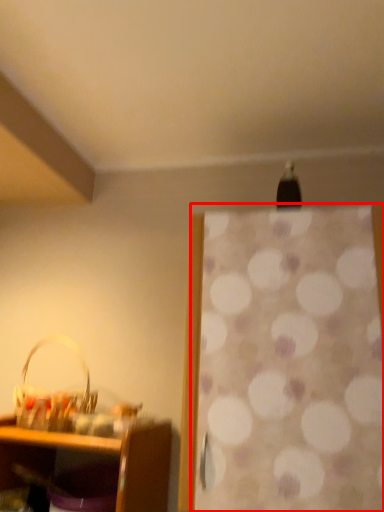
Question: Considering the relative positions of curtain (annotated by the red box) and basket in the image provided, where is curtain (annotated by the red box) located with respect to the staircase?

Choices:
 (A) right
 (B) left

Answer: (A)